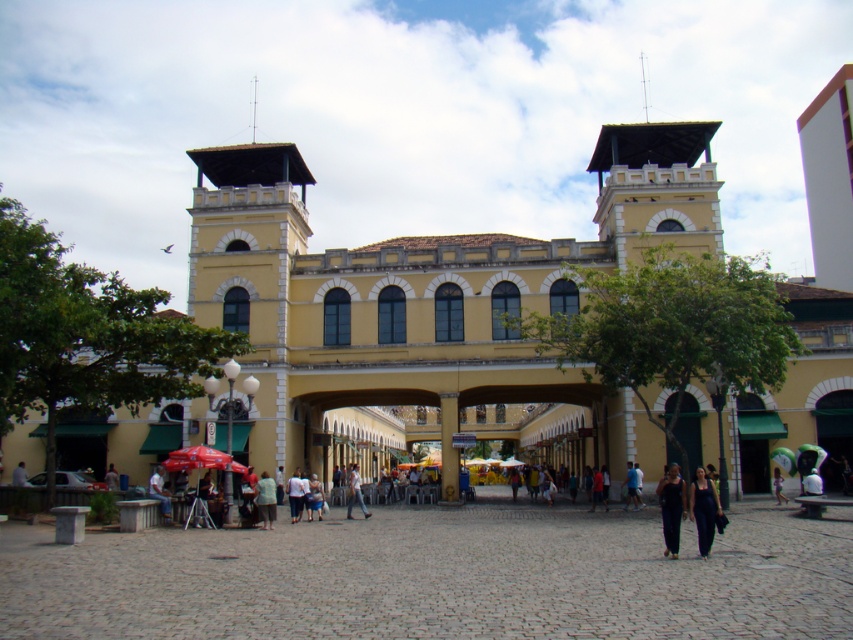
Question: Does light brown wooden chair at lower left appear over light brown fabric pants at center?

Choices:
 (A) no
 (B) yes

Answer: (A)

Question: Is the position of yellow matte building at center more distant than that of light blue fabric shirt at center?

Choices:
 (A) no
 (B) yes

Answer: (A)

Question: Which point is farther from the camera taking this photo?

Choices:
 (A) (648, 134)
 (B) (674, 508)
 (C) (161, 490)

Answer: (A)

Question: Which of the following is the closest to the observer?

Choices:
 (A) dark blue fabric pants at lower right
 (B) black matte pants at lower right

Answer: (A)

Question: Is light blue fabric shirt at center wider than light brown wooden chair at lower left?

Choices:
 (A) yes
 (B) no

Answer: (B)

Question: Which point is farther to the camera?

Choices:
 (A) (778, 470)
 (B) (360, 502)
 (C) (706, 508)

Answer: (A)